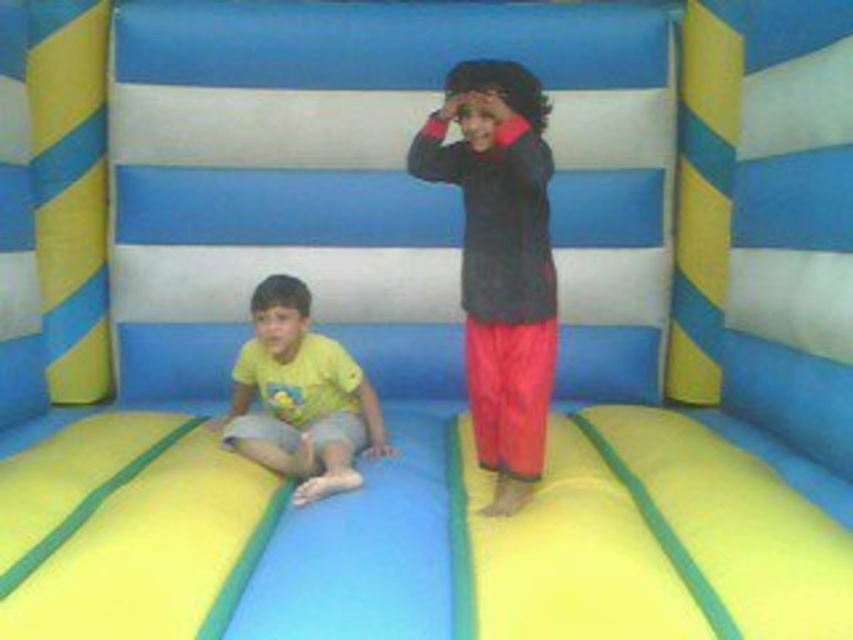
Question: Among these points, which one is farthest from the camera?

Choices:
 (A) (537, 124)
 (B) (271, 352)

Answer: (B)

Question: From the image, what is the correct spatial relationship of dark gray fleece jacket at center in relation to yellow matte shirt at lower left?

Choices:
 (A) below
 (B) above

Answer: (B)

Question: Can you confirm if dark gray fleece jacket at center is positioned to the left of yellow matte shirt at lower left?

Choices:
 (A) yes
 (B) no

Answer: (B)

Question: Is dark gray fleece jacket at center in front of yellow matte shirt at lower left?

Choices:
 (A) no
 (B) yes

Answer: (B)